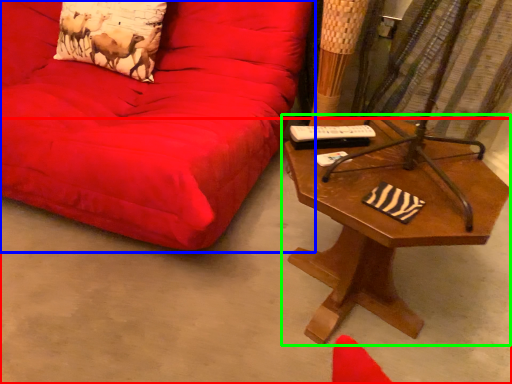
Question: Which is nearer to the concrete (highlighted by a red box)? studio couch (highlighted by a blue box) or table (highlighted by a green box).

Choices:
 (A) studio couch
 (B) table

Answer: (A)